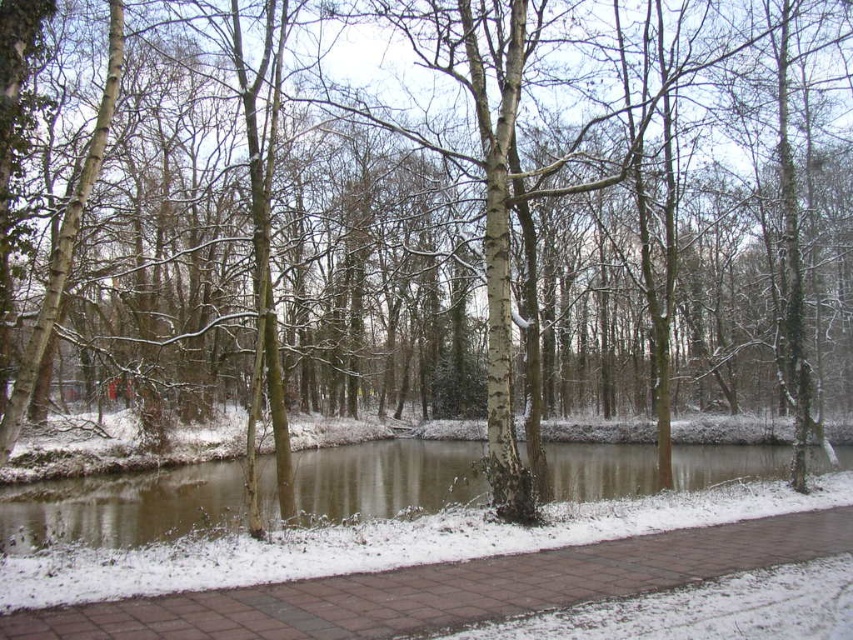
You are standing at the starting point of the brick paved path at center. Looking at the coordinates provided, what direction should you walk to reach the center of the image?

Since the brick paved path at center is located at coordinates point (448, 588), you should walk towards the left to reach the center of the image because the x coordinate is greater than 0.5, meaning it is to the right side of the image. To move towards the center, you need to go left.